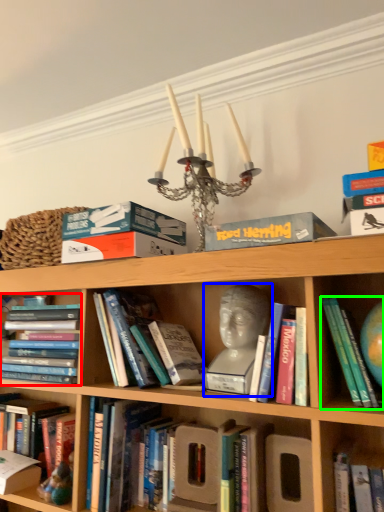
Question: Which object is the farthest from book (highlighted by a red box)? Choose among these: person (highlighted by a blue box) or book (highlighted by a green box).

Choices:
 (A) person
 (B) book

Answer: (B)